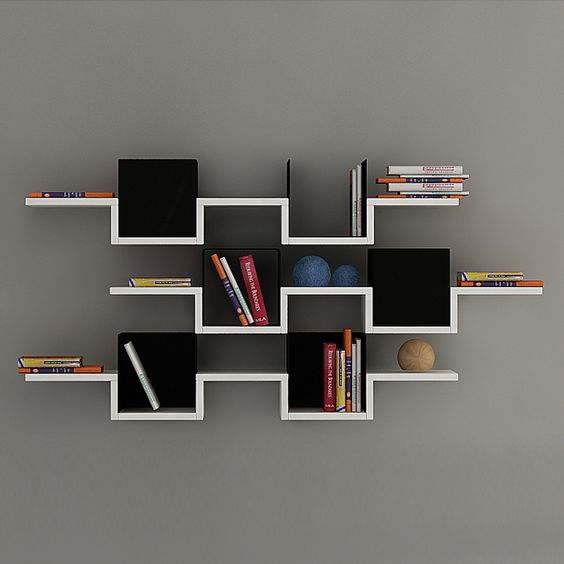
Locate an element on the screen. books on top shelve is located at coordinates (77, 192), (352, 193), (355, 179), (362, 176), (407, 169), (415, 173), (418, 178), (418, 185), (420, 190), (429, 193).